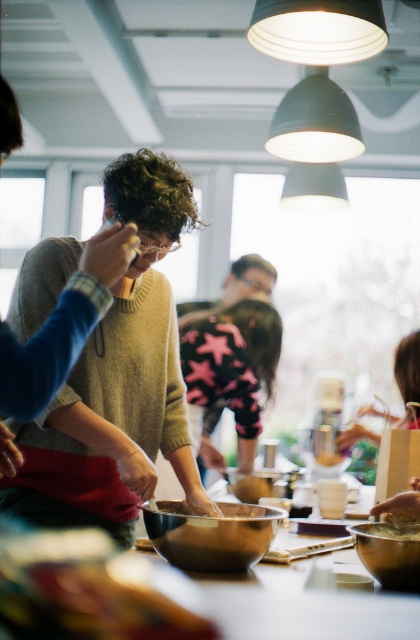
How far apart are pink star-patterned sweater at center and shiny metallic bowl at center?

They are 1.50 meters apart.

Based on the photo, is pink star-patterned sweater at center smaller than shiny metallic bowl at center?

No.

Identify the location of pink star-patterned sweater at center. (231, 371).

Which is above, pink star-patterned sweater at center or matte pink sweater at center?

pink star-patterned sweater at center is above.

Can you confirm if pink star-patterned sweater at center is positioned to the right of matte pink sweater at center?

No, pink star-patterned sweater at center is not to the right of matte pink sweater at center.

Locate an element on the screen. pink star-patterned sweater at center is located at coordinates (231, 371).

Where is `pink star-patterned sweater at center`? pink star-patterned sweater at center is located at coordinates (231, 371).

Which is above, shiny metallic bowl at center or matte pink sweater at center?

Positioned higher is matte pink sweater at center.

Between point (238, 563) and point (417, 412), which one is positioned in front?

Point (238, 563)

Between point (238, 572) and point (357, 432), which one is positioned in front?

Point (238, 572) is more forward.

Where is `shiny metallic bowl at center`? This screenshot has height=640, width=420. shiny metallic bowl at center is located at coordinates click(212, 534).